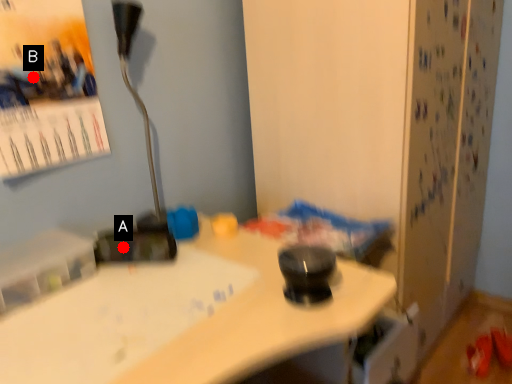
Question: Two points are circled on the image, labeled by A and B beside each circle. Which point is farther to the camera?

Choices:
 (A) A is further
 (B) B is further

Answer: (A)